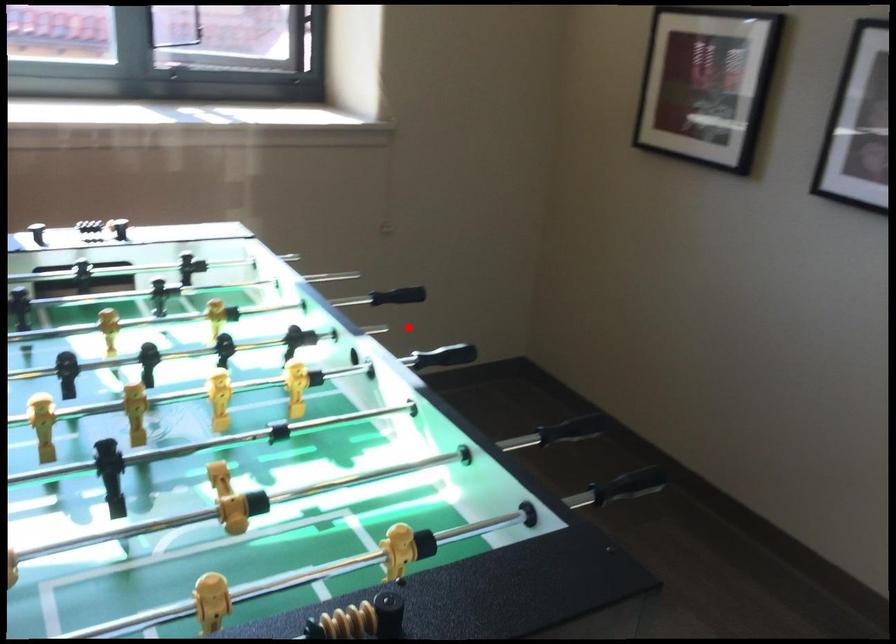
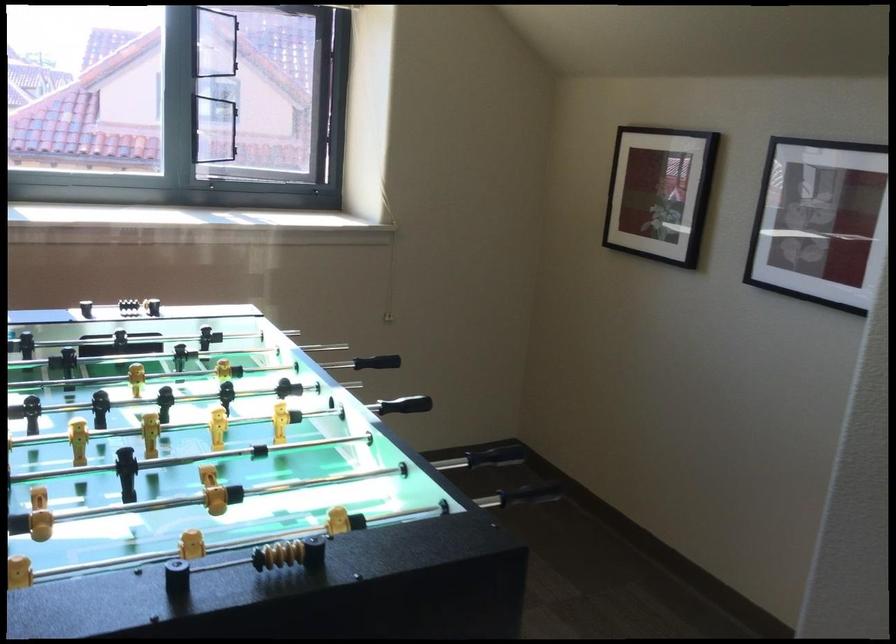
Locate, in the second image, the point that corresponds to the highlighted location in the first image.

(406, 404)